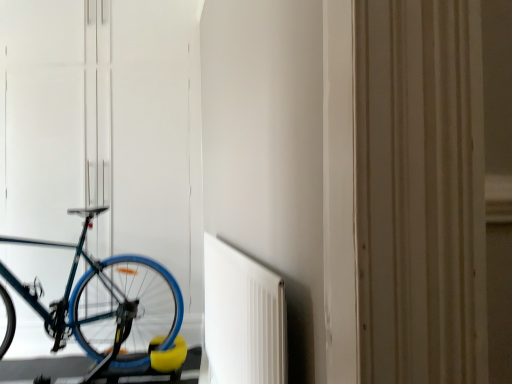
Question: Can you confirm if teal matte bicycle at left is smaller than white matte radiator at center?

Choices:
 (A) no
 (B) yes

Answer: (A)

Question: Is teal matte bicycle at left positioned in front of white matte radiator at center?

Choices:
 (A) yes
 (B) no

Answer: (B)

Question: Is teal matte bicycle at left next to white matte radiator at center and touching it?

Choices:
 (A) no
 (B) yes

Answer: (A)

Question: Is teal matte bicycle at left not inside white matte radiator at center?

Choices:
 (A) yes
 (B) no

Answer: (A)

Question: Considering the relative sizes of teal matte bicycle at left and white matte radiator at center in the image provided, is teal matte bicycle at left bigger than white matte radiator at center?

Choices:
 (A) no
 (B) yes

Answer: (B)

Question: Considering the relative sizes of teal matte bicycle at left and white matte radiator at center in the image provided, is teal matte bicycle at left thinner than white matte radiator at center?

Choices:
 (A) yes
 (B) no

Answer: (B)

Question: Is white matte radiator at center thinner than teal matte bicycle at left?

Choices:
 (A) yes
 (B) no

Answer: (A)

Question: From the image's perspective, is white matte radiator at center under teal matte bicycle at left?

Choices:
 (A) yes
 (B) no

Answer: (A)

Question: Considering the relative sizes of white matte radiator at center and teal matte bicycle at left in the image provided, is white matte radiator at center wider than teal matte bicycle at left?

Choices:
 (A) no
 (B) yes

Answer: (A)

Question: Is white matte radiator at center oriented towards teal matte bicycle at left?

Choices:
 (A) no
 (B) yes

Answer: (B)

Question: From the image's perspective, is white matte radiator at center located above teal matte bicycle at left?

Choices:
 (A) no
 (B) yes

Answer: (A)

Question: From a real-world perspective, is white matte radiator at center on teal matte bicycle at left?

Choices:
 (A) no
 (B) yes

Answer: (A)

Question: Looking at their shapes, would you say white matte radiator at center is wider or thinner than teal matte bicycle at left?

Choices:
 (A) thin
 (B) wide

Answer: (A)